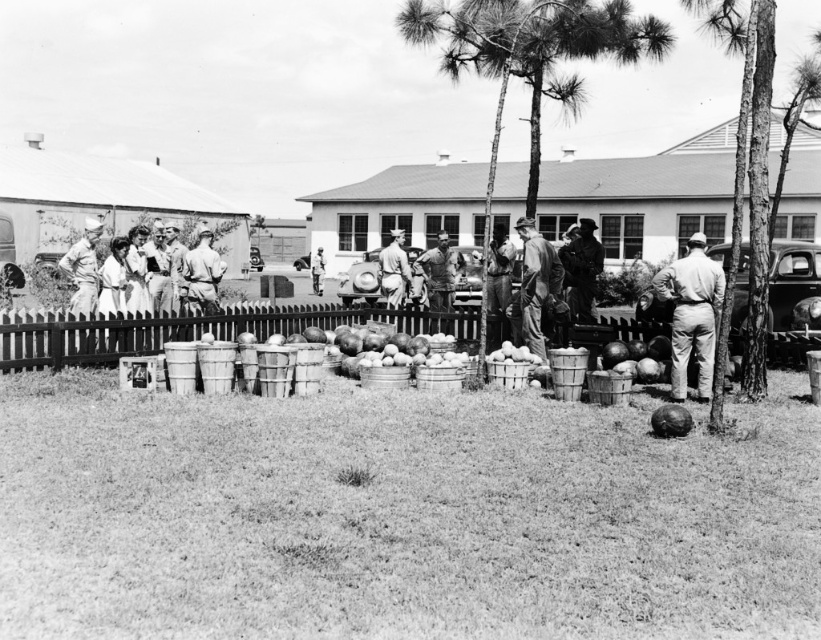
Question: Which point is farther to the camera?

Choices:
 (A) rustic wood crate at center
 (B) smooth leather jacket at center
 (C) light brown uniform at center
 (D) smooth wooden basket at center

Answer: (C)

Question: Which of these objects is positioned farthest from the light blue uniform at center?

Choices:
 (A) smooth leather jacket at center
 (B) smooth wooden basket at center
 (C) rugged denim jacket at center

Answer: (B)

Question: Where is light brown fabric pants at right located in relation to rustic wood crate at center in the image?

Choices:
 (A) right
 (B) left

Answer: (A)

Question: Among these points, which one is nearest to the camera?

Choices:
 (A) click(x=393, y=332)
 (B) click(x=401, y=276)
 (C) click(x=315, y=266)
 (D) click(x=443, y=284)

Answer: (A)

Question: Is light brown fabric pants at right closer to the viewer compared to rustic wood crate at center?

Choices:
 (A) no
 (B) yes

Answer: (B)

Question: Is rugged denim jacket at center smaller than light brown uniform at center?

Choices:
 (A) no
 (B) yes

Answer: (B)